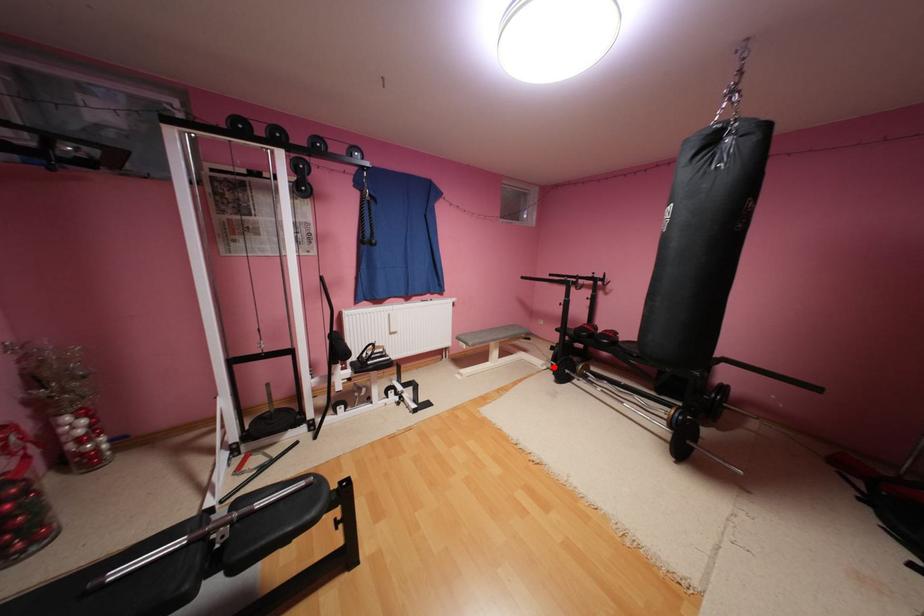
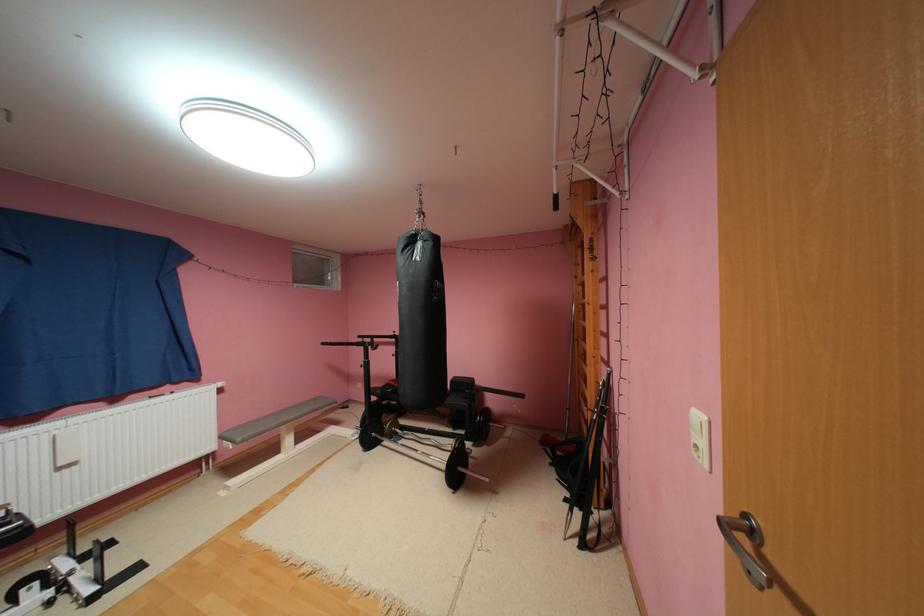
Locate, in the second image, the point that corresponds to the highlighted location in the first image.

(366, 436)